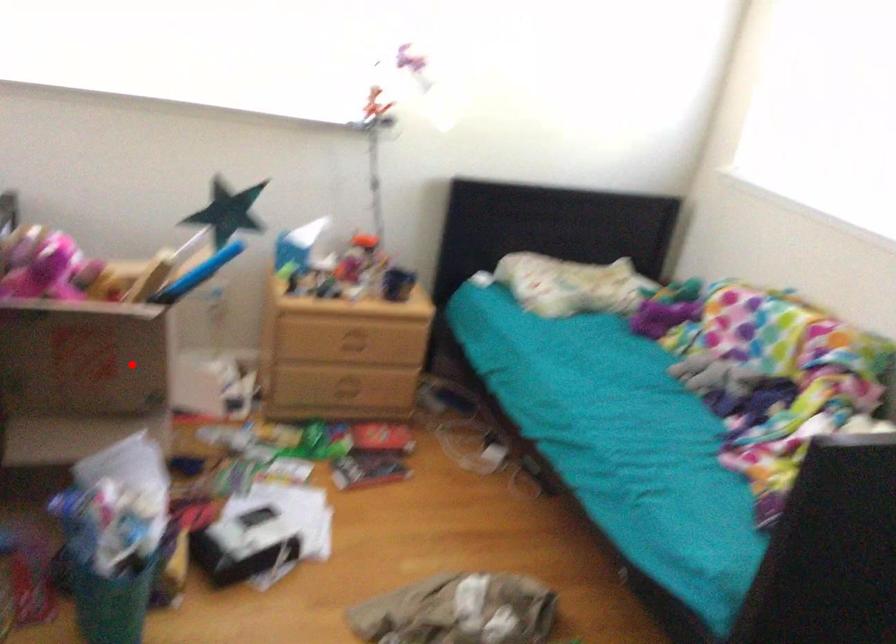
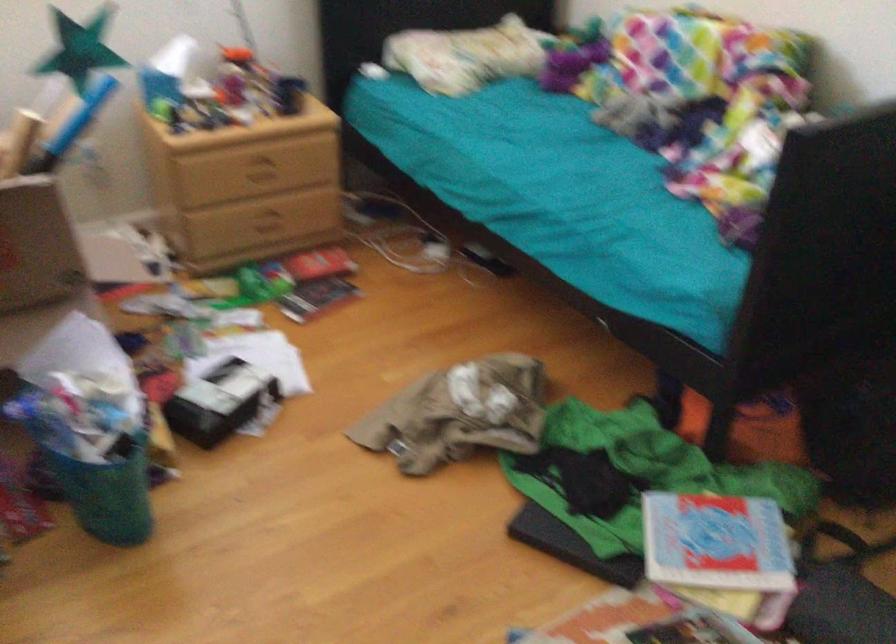
Question: I am providing you with two images of the same scene from different viewpoints. A red point is shown in image1. For the corresponding object point in image2, is it positioned nearer or farther from the camera?

Choices:
 (A) Nearer
 (B) Farther

Answer: (A)